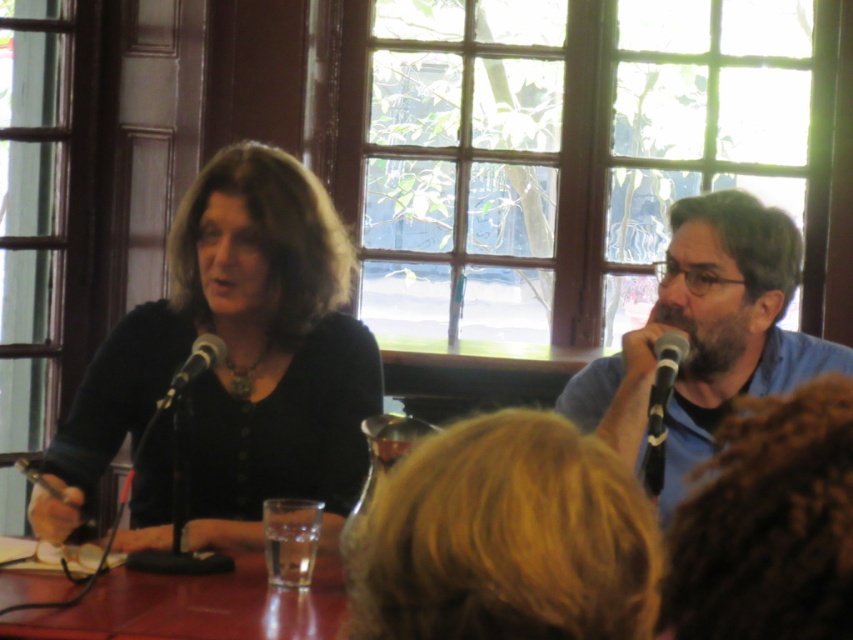
You are a sound technician setting up for a live event. You have two microphones on the table in front of you. The black plastic microphone at right and the black metallic microphone at left. Which microphone is positioned lower on the table?

The black plastic microphone at right is positioned lower on the table as it is below the black metallic microphone at left.

You are standing in the room depicted in the scene. You need to place a small plant on the table such that it is exactly 0.1 units to the right of the black plastic microphone at right. What are the 2D coordinates where you should place the plant?

The black plastic microphone at right is located at point (664, 380). To place the plant 0.1 units to the right, add 0.1 to the x coordinate, resulting in coordinates (664, 444).